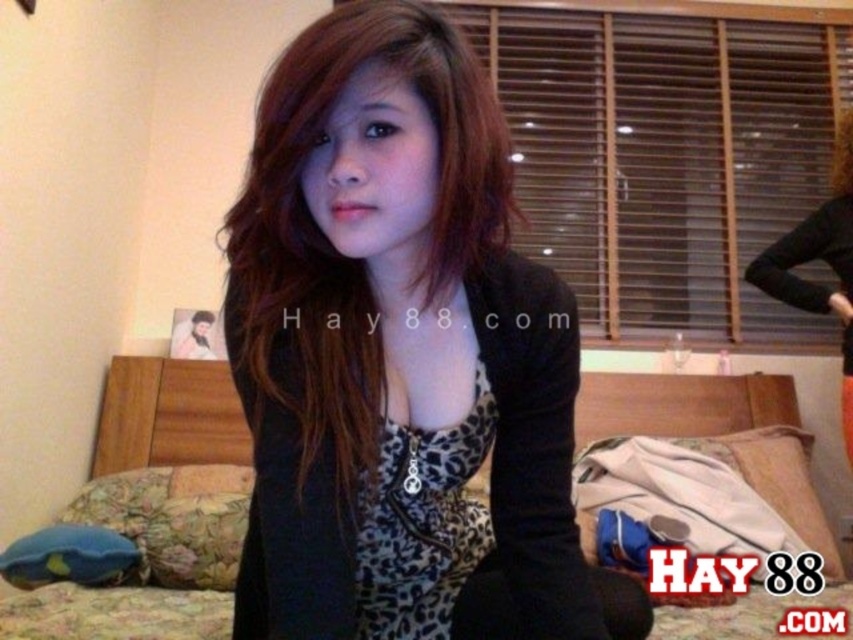
Does matte black jacket at center lie behind floral fabric bed at center?

No, it is in front of floral fabric bed at center.

Between matte black jacket at center and floral fabric bed at center, which one appears on the right side from the viewer's perspective?

floral fabric bed at center

Describe the element at coordinates (401, 356) in the screenshot. Image resolution: width=853 pixels, height=640 pixels. I see `matte black jacket at center` at that location.

Image resolution: width=853 pixels, height=640 pixels. I want to click on matte black jacket at center, so click(x=401, y=356).